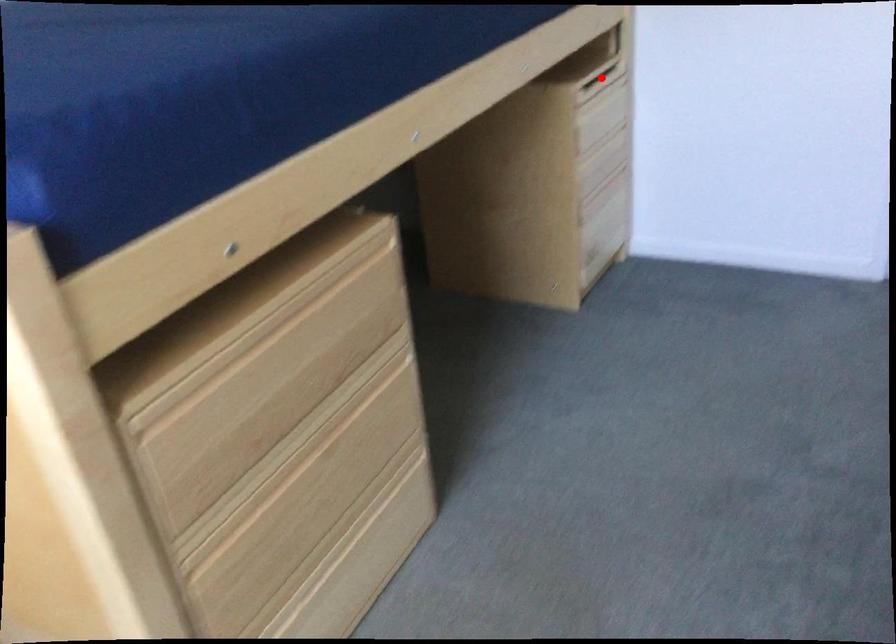
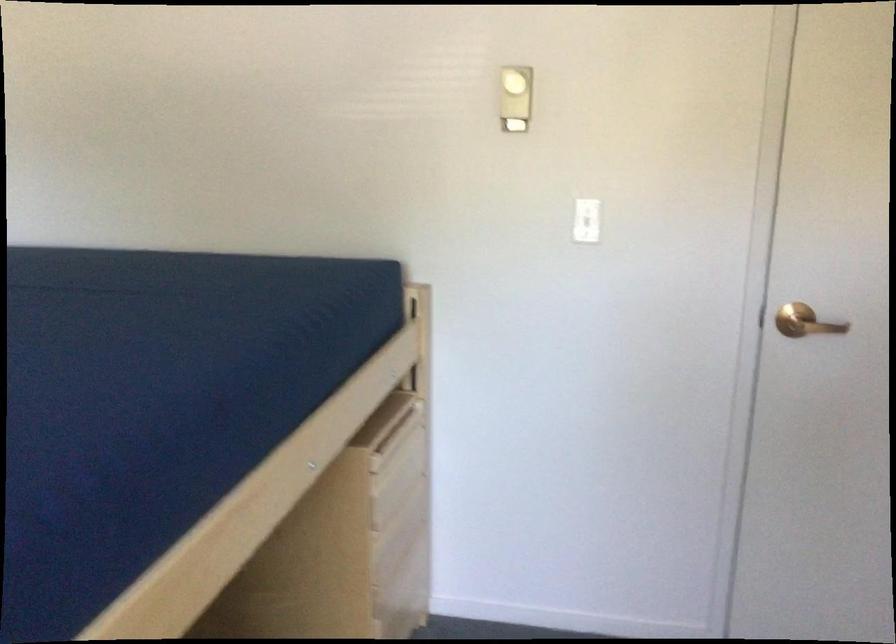
The point at the highlighted location is marked in the first image. Where is the corresponding point in the second image?

(399, 429)